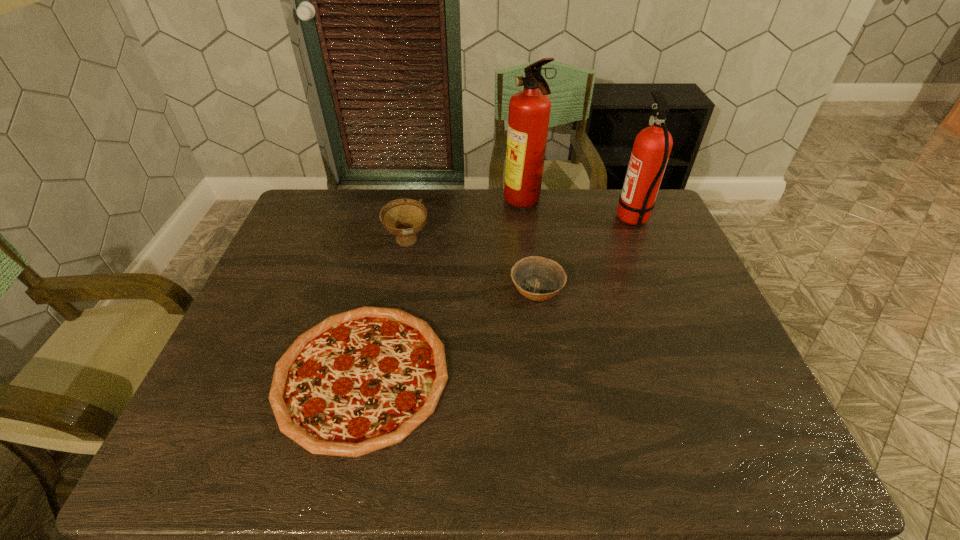
You are a GUI agent. You are given a task and a screenshot of the screen. Output one action in this format:
    pyautogui.click(x=<x>, y=<y>)
    Task: Click on the object at the left edge
    The image size is (960, 540).
    Given the screenshot: What is the action you would take?
    pyautogui.click(x=362, y=380)

Where is `object that is positioned at the right edge`? This screenshot has height=540, width=960. object that is positioned at the right edge is located at coordinates (652, 146).

Identify the location of object that is at the near left corner. This screenshot has height=540, width=960. (362, 380).

Where is `object that is at the far right corner`? This screenshot has height=540, width=960. object that is at the far right corner is located at coordinates (652, 146).

This screenshot has height=540, width=960. Identify the location of blank area at the far edge. (568, 204).

Where is `free region at the near edge of the desktop`? free region at the near edge of the desktop is located at coordinates (611, 438).

Where is `blank space at the right edge`? This screenshot has width=960, height=540. blank space at the right edge is located at coordinates (738, 399).

Image resolution: width=960 pixels, height=540 pixels. I want to click on vacant region at the near left corner of the desktop, so click(x=208, y=437).

The height and width of the screenshot is (540, 960). I want to click on vacant region between the left fire extinguisher and the bowl, so click(x=530, y=246).

This screenshot has height=540, width=960. Find the location of `vacant space that is in between the shortest object and the left fire extinguisher`. vacant space that is in between the shortest object and the left fire extinguisher is located at coordinates (443, 289).